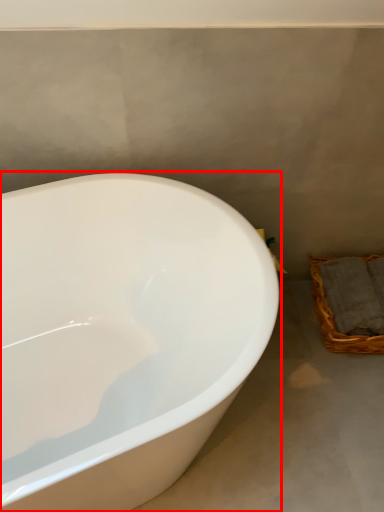
Question: From the image's perspective, considering the relative positions of bathtub (annotated by the red box) and basket in the image provided, where is bathtub (annotated by the red box) located with respect to the staircase?

Choices:
 (A) above
 (B) below

Answer: (B)